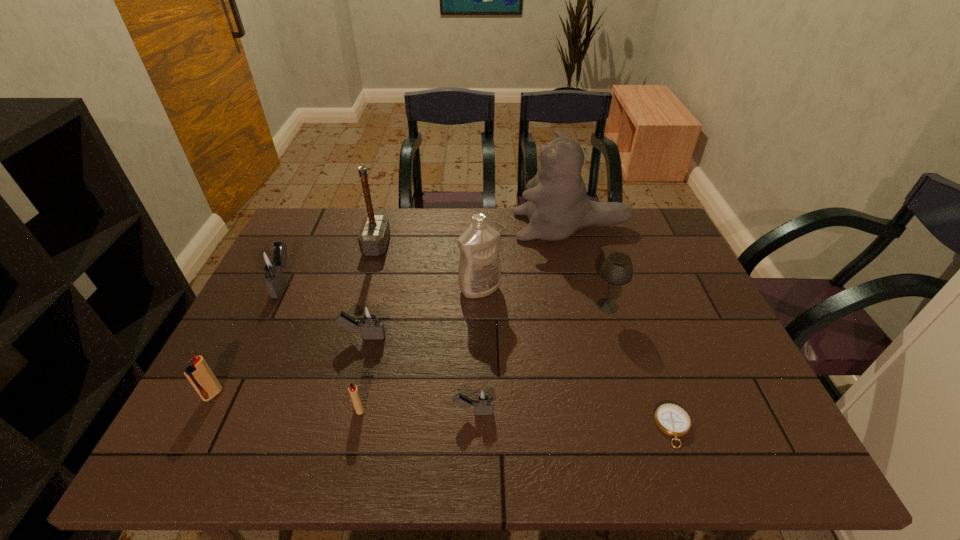
You are a GUI agent. You are given a task and a screenshot of the screen. Output one action in this format:
    pyautogui.click(x=<x>, y=<y>)
    Task: Click on the smaller red igniter
    This screenshot has width=960, height=540.
    Given the screenshot: What is the action you would take?
    [352, 388]

Identify the location of the nearer red igniter. (352, 388).

In order to click on the smallest gray igniter in this screenshot , I will do `click(483, 399)`.

Where is `the rightmost igniter`? This screenshot has width=960, height=540. the rightmost igniter is located at coordinates click(483, 399).

Identify the location of the shortest object. This screenshot has width=960, height=540. (671, 419).

Identify the location of blank space located 0.050m on the face of the green cat. click(x=499, y=226).

The width and height of the screenshot is (960, 540). I want to click on vacant space located on the face of the green cat, so click(x=448, y=226).

In order to click on free space located on the face of the green cat in this screenshot , I will do [443, 226].

Where is `vacant space located 0.160m on the striking surface of the hammer`? vacant space located 0.160m on the striking surface of the hammer is located at coordinates (439, 245).

Where is `free space located 0.110m on the left of the white detergent`? Image resolution: width=960 pixels, height=540 pixels. free space located 0.110m on the left of the white detergent is located at coordinates pos(420,289).